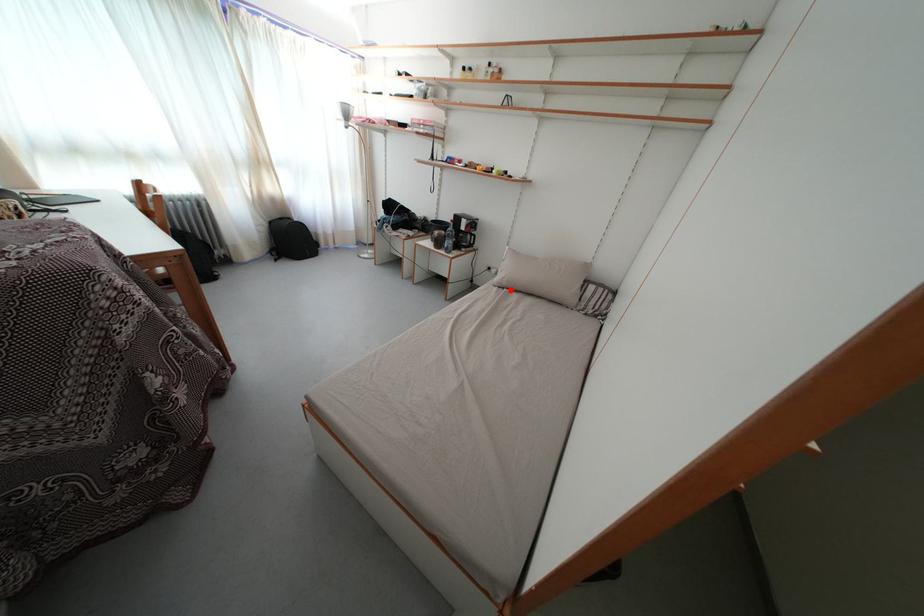
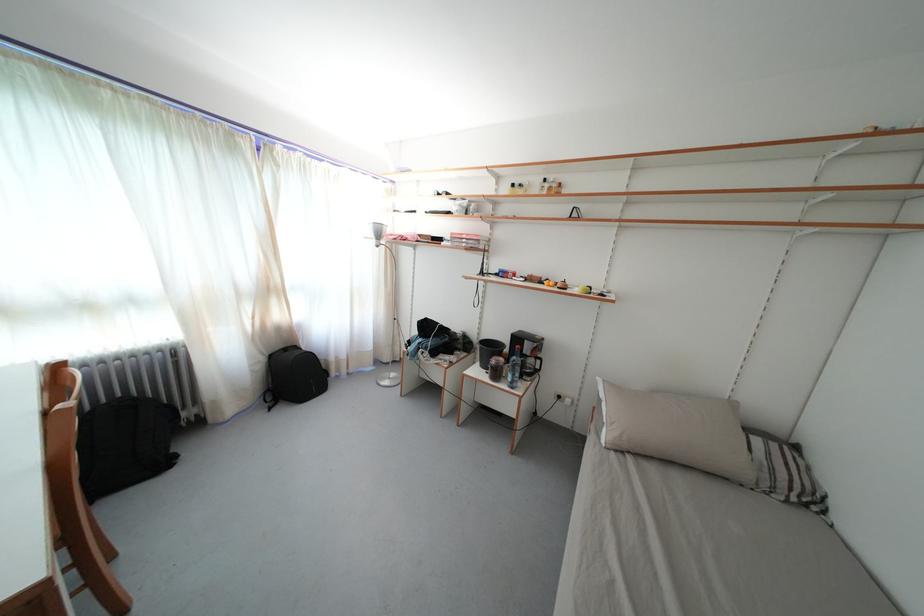
Question: I am providing you with two images of the same scene from different viewpoints. Image1 has a red point marked. In image2, the corresponding 3D location appears at what relative position? Reply with the corresponding letter.

Choices:
 (A) Closer
 (B) Farther

Answer: (B)